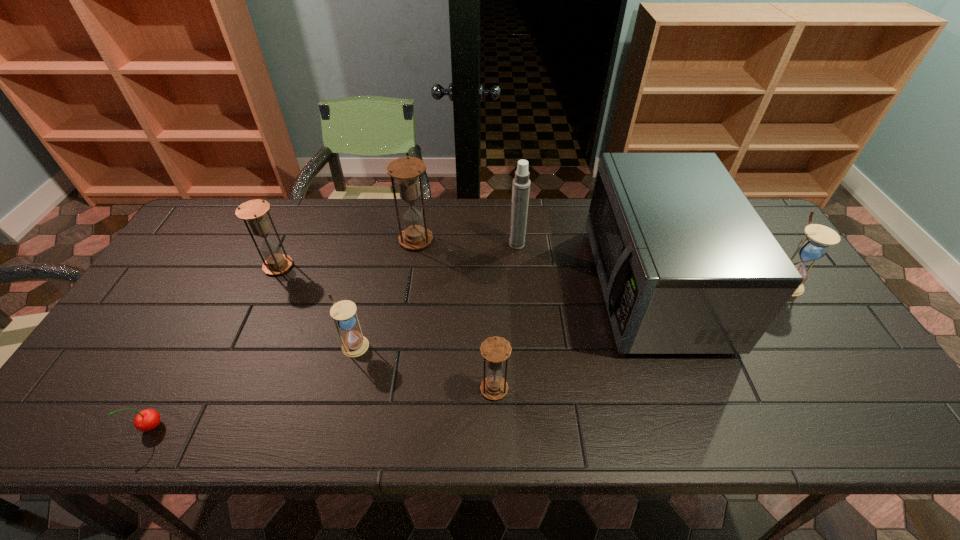
This screenshot has width=960, height=540. Find the location of `white aerosol can`. white aerosol can is located at coordinates (521, 183).

At what (x,y) coordinates should I click in order to perform the action: click on the sixth object from left to right. Please return your answer as a coordinate pair (x, y). Looking at the image, I should click on (521, 183).

What are the coordinates of `microwave oven` in the screenshot? It's located at (686, 265).

This screenshot has width=960, height=540. What are the coordinates of `the third hourglass from left to right` in the screenshot? It's located at tap(406, 170).

Where is `the fifth object from right to left`? the fifth object from right to left is located at coordinates (406, 170).

Locate an element on the screen. Image resolution: width=960 pixels, height=540 pixels. the second biggest brown hourglass is located at coordinates (254, 211).

The width and height of the screenshot is (960, 540). Identify the location of the leftmost hourglass. (254, 211).

The height and width of the screenshot is (540, 960). Identify the location of the bigger white hourglass. (814, 246).

At what (x,y) coordinates should I click in order to perform the action: click on the rightmost object. Please return your answer as a coordinate pair (x, y). Looking at the image, I should click on (814, 246).

Find the location of a particular element. the left white hourglass is located at coordinates (354, 344).